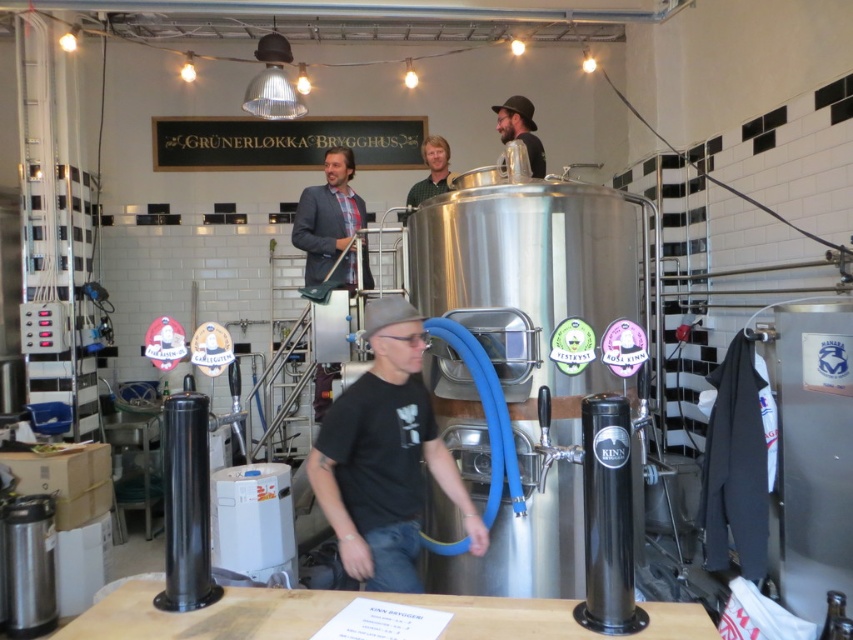
Question: Is matte black hat at upper center closer to the viewer compared to matte green shirt at center?

Choices:
 (A) no
 (B) yes

Answer: (B)

Question: Is black matte t-shirt at center thinner than matte green shirt at center?

Choices:
 (A) no
 (B) yes

Answer: (A)

Question: Which of these objects is positioned farthest from the matte green shirt at center?

Choices:
 (A) black matte t-shirt at center
 (B) matte black hat at upper center

Answer: (A)

Question: Which of the following is the farthest from the observer?

Choices:
 (A) matte black hat at upper center
 (B) matte green shirt at center
 (C) black matte t-shirt at center

Answer: (B)

Question: Which of these objects is positioned farthest from the black matte t-shirt at center?

Choices:
 (A) matte green shirt at center
 (B) matte black hat at upper center

Answer: (A)

Question: Can you confirm if matte black hat at upper center is positioned to the right of matte green shirt at center?

Choices:
 (A) yes
 (B) no

Answer: (A)